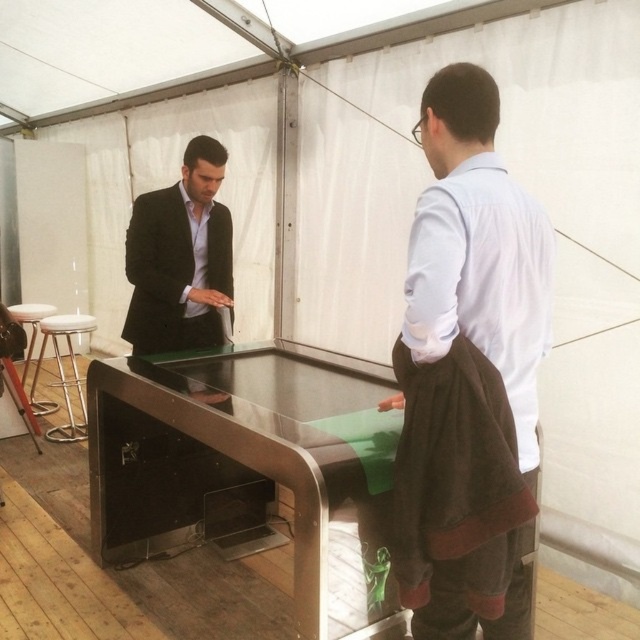
Question: Is transparent glass table at center to the right of brown woolen sweater at center from the viewer's perspective?

Choices:
 (A) no
 (B) yes

Answer: (A)

Question: In this image, where is transparent glass table at center located relative to brown woolen sweater at center?

Choices:
 (A) below
 (B) above

Answer: (A)

Question: Among these objects, which one is farthest from the camera?

Choices:
 (A) transparent glass table at center
 (B) brown woolen sweater at center
 (C) black matte suit at center
 (D) white leather stool at left

Answer: (D)

Question: Among these objects, which one is farthest from the camera?

Choices:
 (A) black matte suit at center
 (B) white leather stool at left

Answer: (B)

Question: Which of the following is the closest to the observer?

Choices:
 (A) white fabric stool at left
 (B) white leather stool at left

Answer: (B)

Question: Does brown woolen sweater at center have a lesser width compared to black matte suit at center?

Choices:
 (A) yes
 (B) no

Answer: (A)